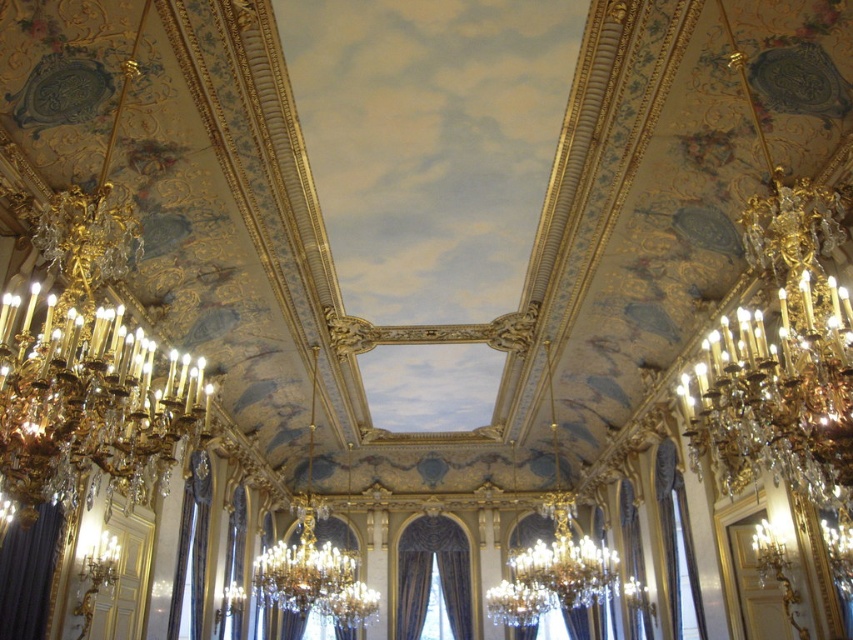
In the scene shown: Can you confirm if velvet drapery at center is positioned to the left of dark blue velvet curtain at lower left?

No, velvet drapery at center is not to the left of dark blue velvet curtain at lower left.

Image resolution: width=853 pixels, height=640 pixels. What do you see at coordinates (428, 576) in the screenshot? I see `velvet drapery at center` at bounding box center [428, 576].

The height and width of the screenshot is (640, 853). Identify the location of velvet drapery at center. (428, 576).